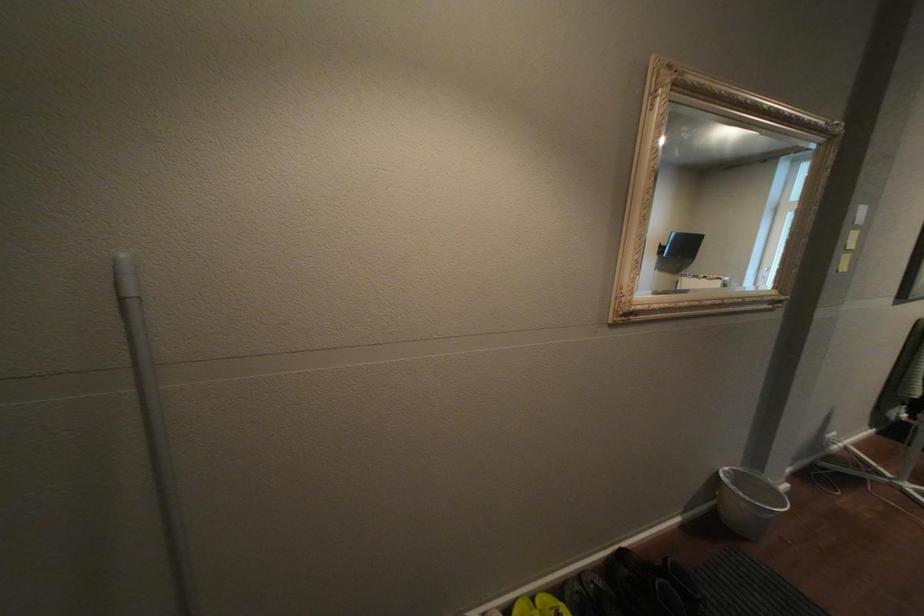
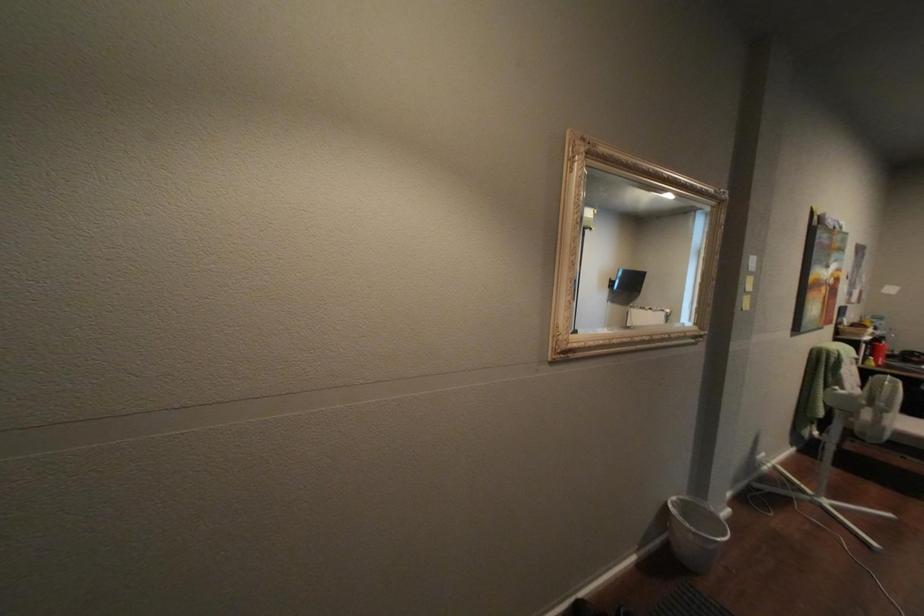
Question: How did the camera likely rotate?

Choices:
 (A) Left
 (B) Right
 (C) Up
 (D) Down

Answer: (B)